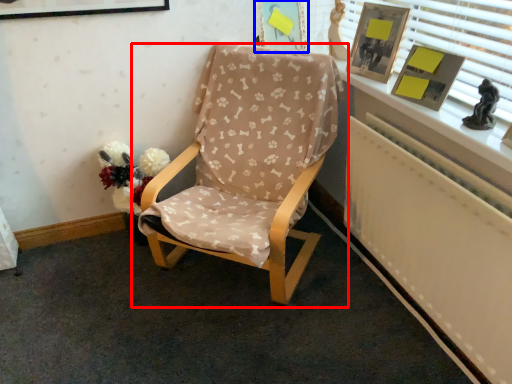
Question: Which object is closer to the camera taking this photo, chair (highlighted by a red box) or picture frame (highlighted by a blue box)?

Choices:
 (A) chair
 (B) picture frame

Answer: (A)